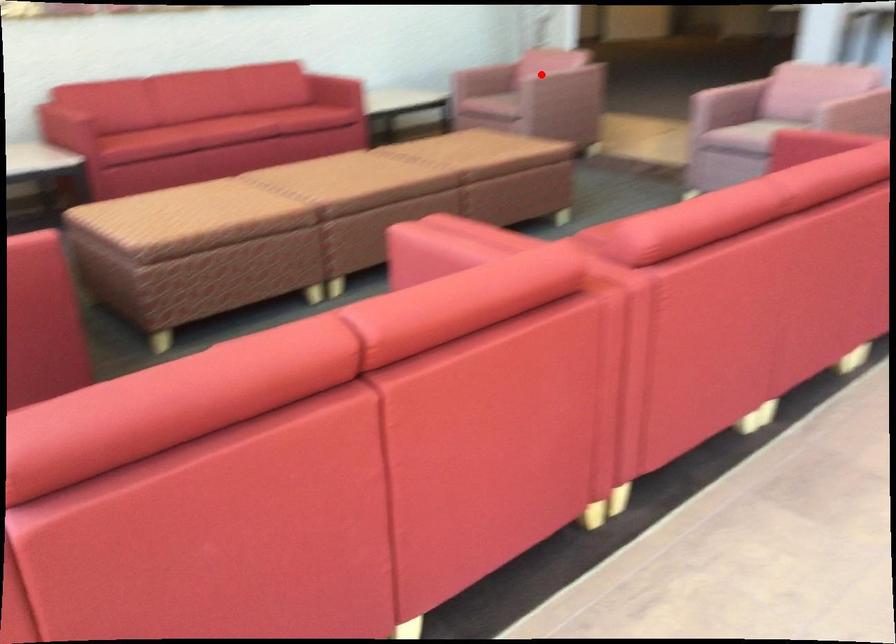
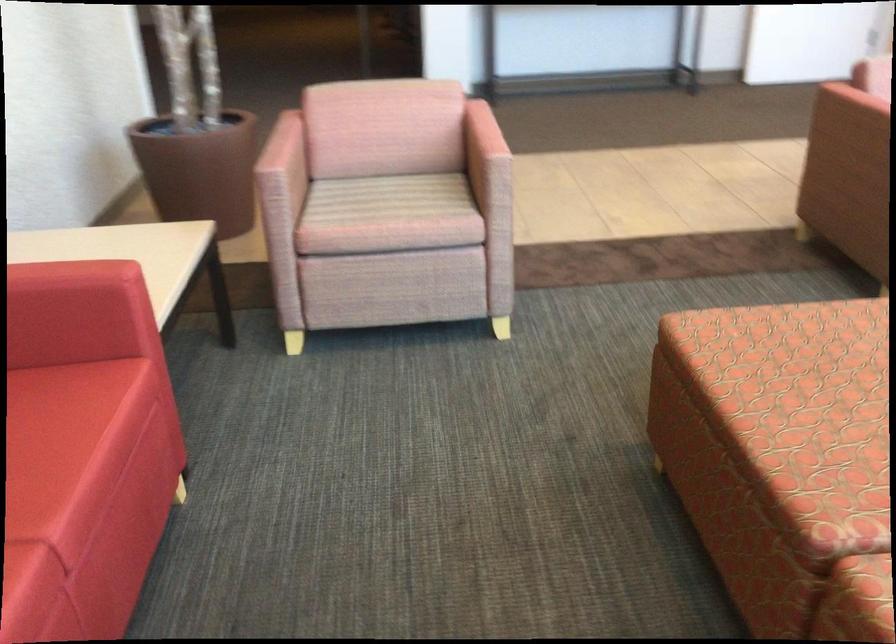
The point at the highlighted location is marked in the first image. Where is the corresponding point in the second image?

(481, 133)